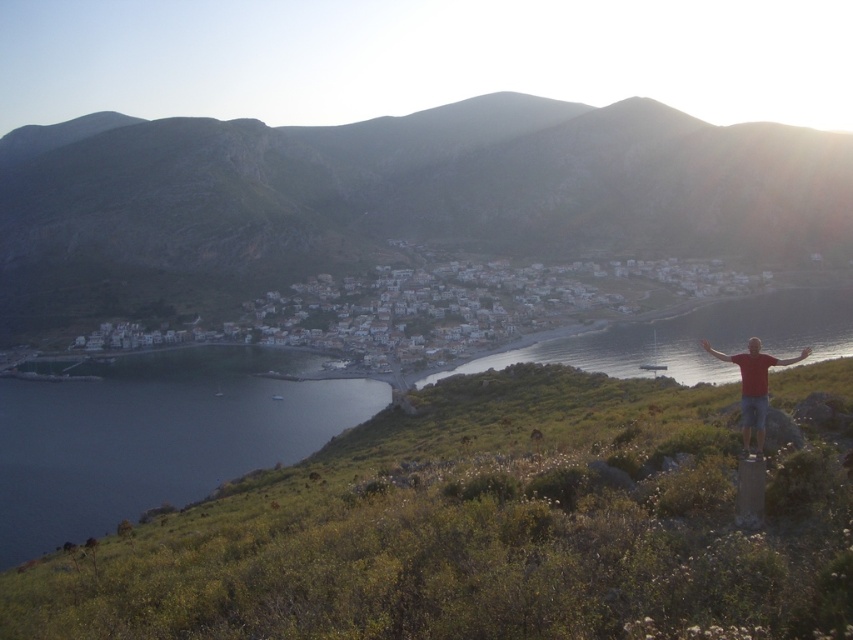
Who is higher up, green grassy hillside at lower right or red matte arm at right?

red matte arm at right is above.

Is green grassy hillside at lower right wider than red matte arm at right?

In fact, green grassy hillside at lower right might be narrower than red matte arm at right.

What do you see at coordinates (490, 525) in the screenshot?
I see `green grassy hillside at lower right` at bounding box center [490, 525].

Where is `green grassy hillside at lower right`? The image size is (853, 640). green grassy hillside at lower right is located at coordinates (490, 525).

Is dark blue water at lower left positioned before red matte arm at right?

No, it is not.

Is dark blue water at lower left to the right of red matte arm at right from the viewer's perspective?

No, dark blue water at lower left is not to the right of red matte arm at right.

Is point (160, 460) closer to viewer compared to point (704, 346)?

No, (160, 460) is further to viewer.

This screenshot has width=853, height=640. I want to click on dark blue water at lower left, so click(x=155, y=435).

Which is in front, point (801, 356) or point (711, 348)?

Positioned in front is point (801, 356).

Can you confirm if light brown leather hand at upper right is smaller than smooth skin hand at right?

Actually, light brown leather hand at upper right might be larger than smooth skin hand at right.

At what (x,y) coordinates should I click in order to perform the action: click on light brown leather hand at upper right. Please return your answer as a coordinate pair (x, y). This screenshot has width=853, height=640. Looking at the image, I should click on (804, 353).